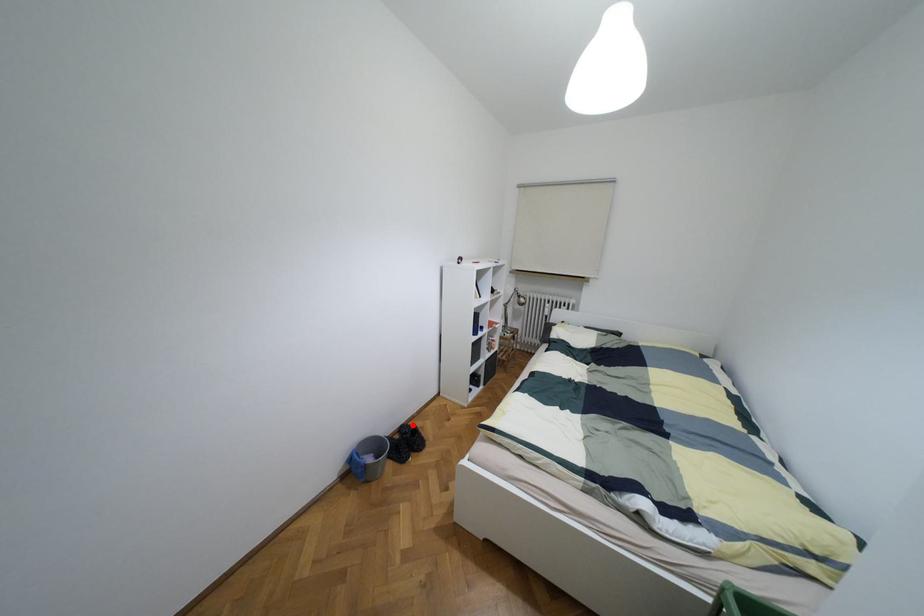
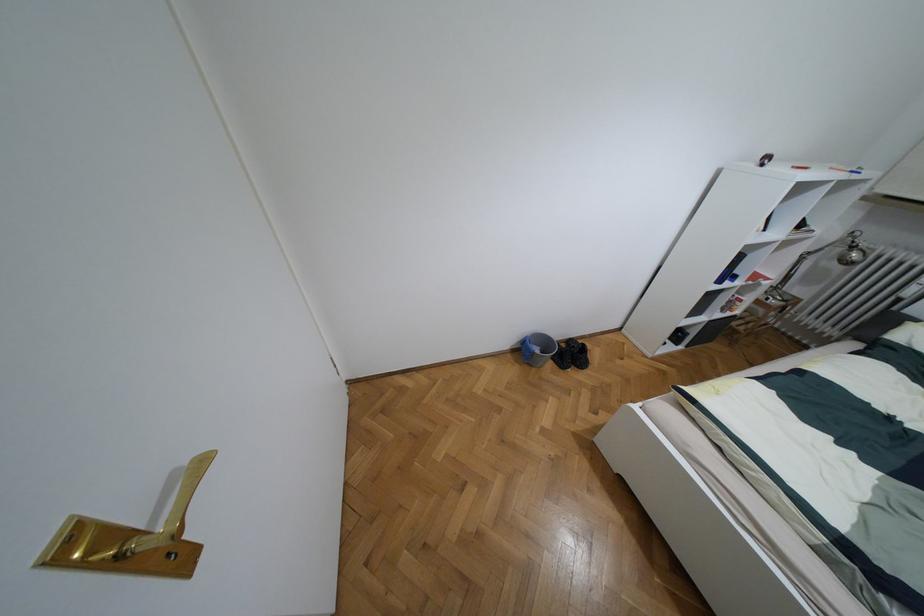
Question: I am providing you with two images of the same scene from different viewpoints. A red point is marked on the first image. At the location where the point appears in image 1, is it still visible in image 2?

Choices:
 (A) Yes
 (B) No

Answer: (A)